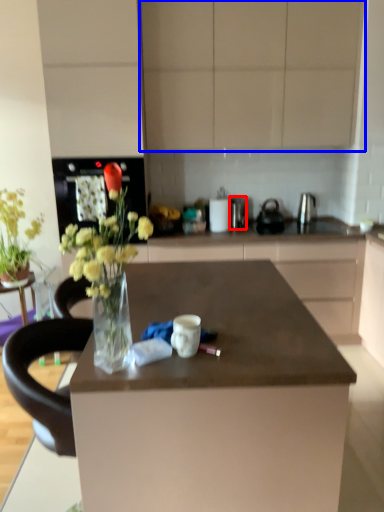
Question: Which object is closer to the camera taking this photo, appliance (highlighted by a red box) or cabinetry (highlighted by a blue box)?

Choices:
 (A) appliance
 (B) cabinetry

Answer: (B)